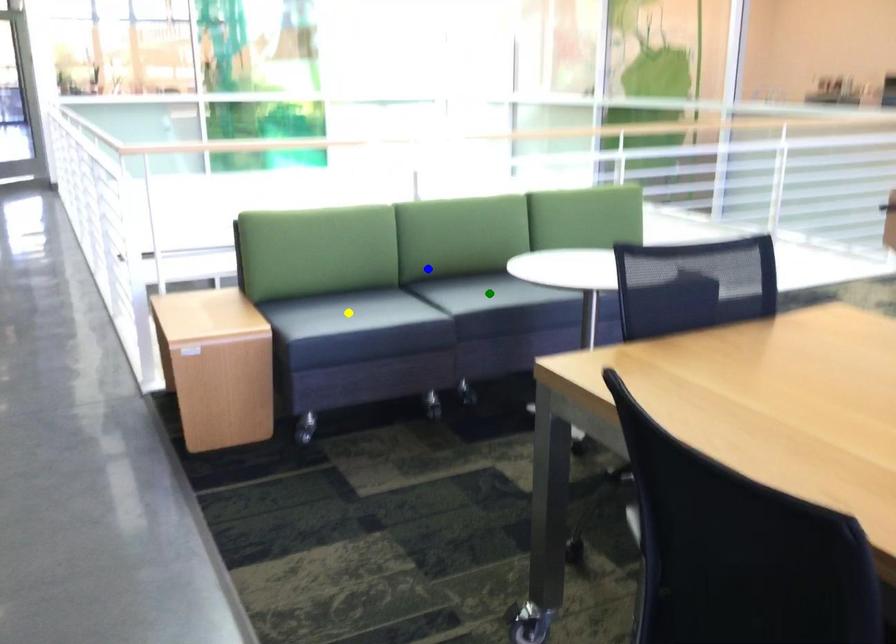
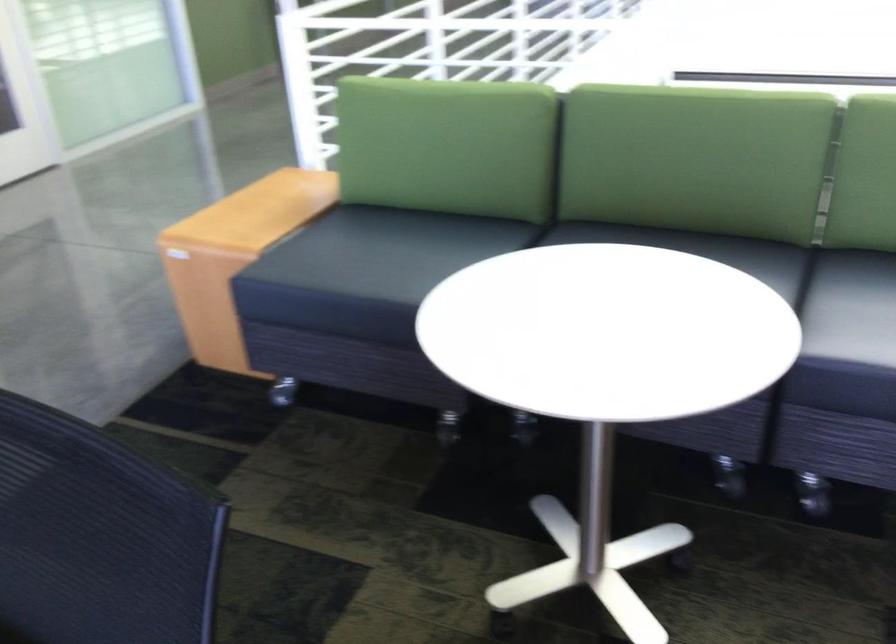
I am providing you with two images of the same scene from different viewpoints. Three points are marked in image1. Which point corresponds to a part or object that is occluded in image2?In image1, three points are marked. Which of them correspond to a part or object that is occluded in image2?Among the three points shown in image1, which one corresponds to a part or object that is no longer visible due to occlusion in image2?

green point